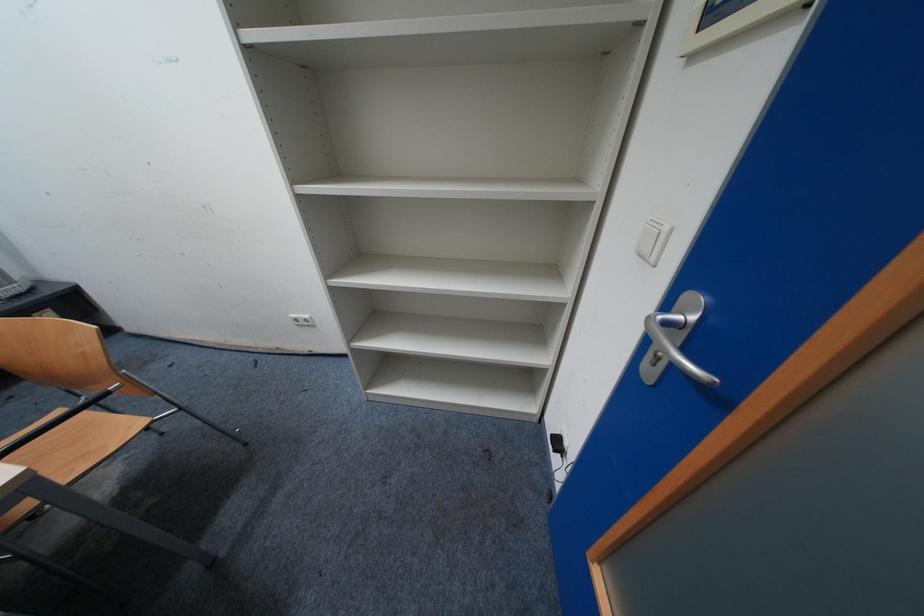
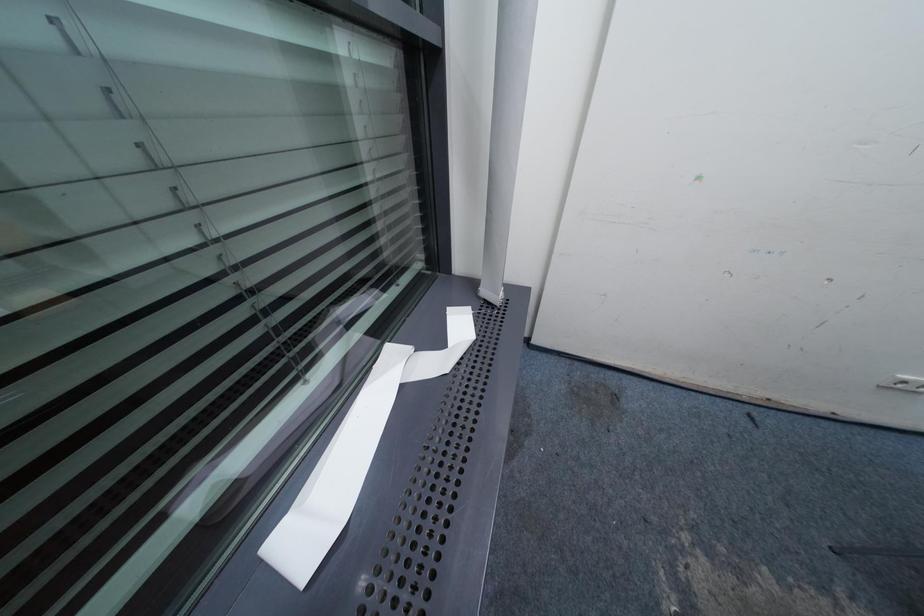
Question: In a continuous first-person perspective shot, in which direction is the camera moving?

Choices:
 (A) Left
 (B) Right
 (C) Forward
 (D) Backward

Answer: (A)